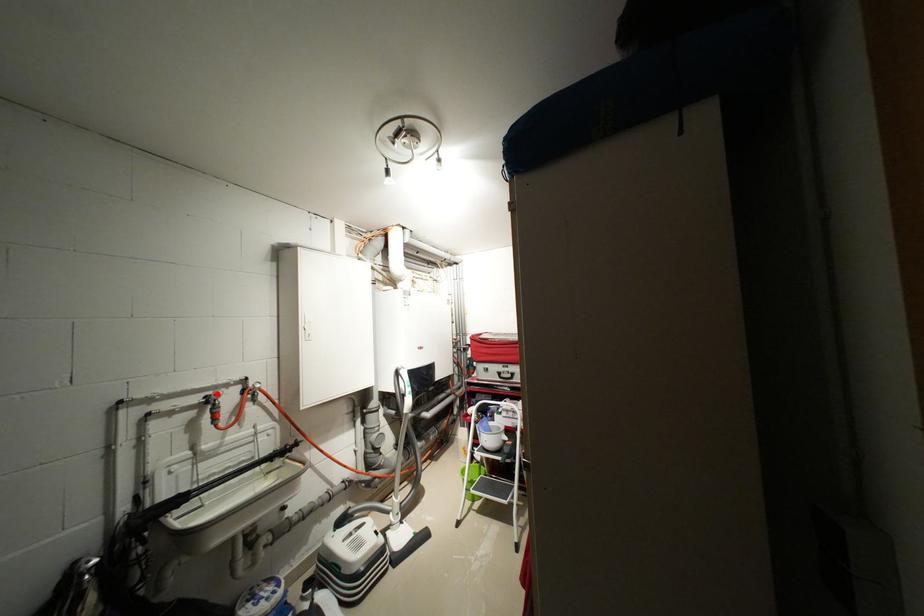
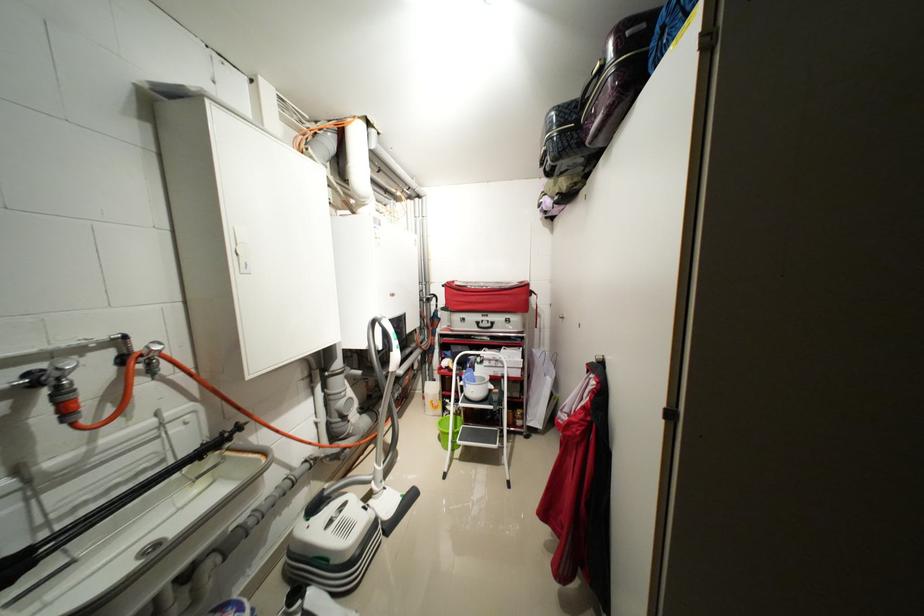
In the second image, find the point that corresponds to the highlighted location in the first image.

(46, 367)